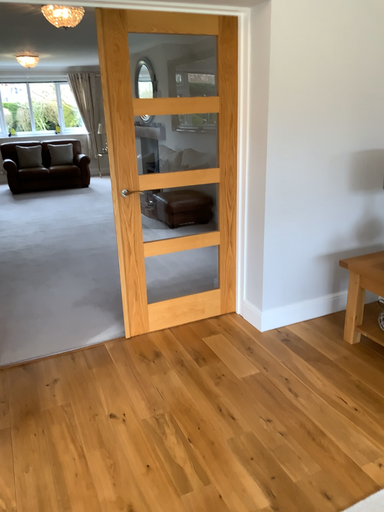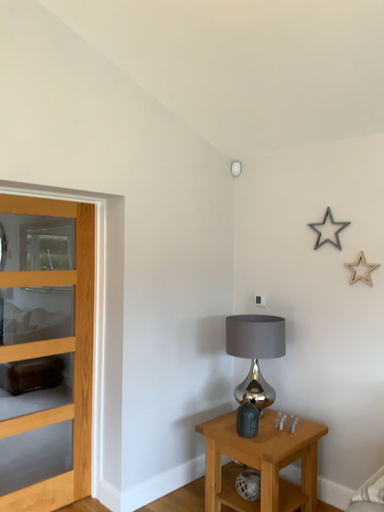
Question: Which way did the camera rotate in the video?

Choices:
 (A) rotated upward
 (B) rotated downward

Answer: (A)